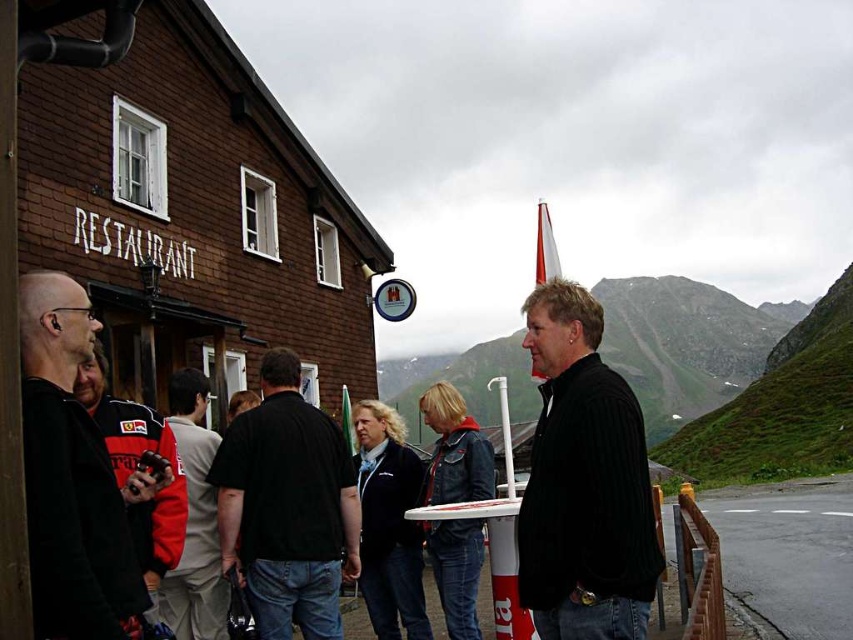
Question: Does black matte jacket at left appear under red and white jacket at center?

Choices:
 (A) no
 (B) yes

Answer: (A)

Question: Considering the real-world distances, which object is farthest from the red and black jacket at left?

Choices:
 (A) black matte jacket at left
 (B) red and white jacket at center
 (C) black cotton shirt at center

Answer: (C)

Question: Can you confirm if black cotton shirt at center is smaller than red and black jacket at left?

Choices:
 (A) no
 (B) yes

Answer: (A)

Question: Which point is closer to the camera taking this photo?

Choices:
 (A) (233, 484)
 (B) (148, 528)
 (C) (129, 595)

Answer: (C)

Question: In this image, where is black matte jacket at left located relative to red and black jacket at left?

Choices:
 (A) below
 (B) above

Answer: (B)

Question: Based on their relative distances, which object is farther from the red and black jacket at left?

Choices:
 (A) black cotton shirt at center
 (B) red and white jacket at center
 (C) black corduroy jacket at center
 (D) black matte jacket at left

Answer: (C)